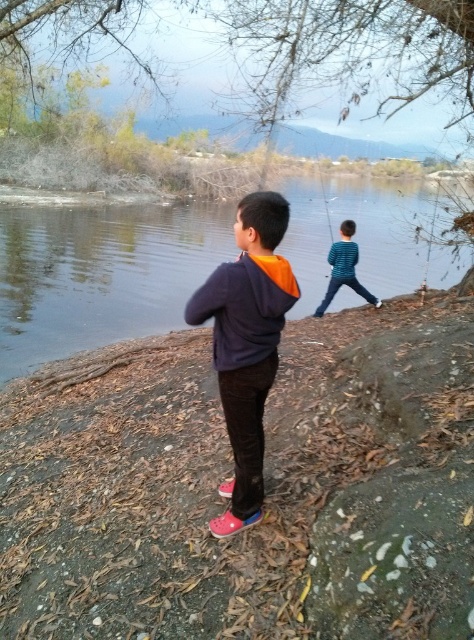
Question: Can you confirm if clear water at center is thinner than orange fleece hoodie at center?

Choices:
 (A) yes
 (B) no

Answer: (B)

Question: Is orange fleece hoodie at center positioned before blue striped shirt at center?

Choices:
 (A) yes
 (B) no

Answer: (A)

Question: Is orange fleece hoodie at center smaller than blue striped shirt at center?

Choices:
 (A) yes
 (B) no

Answer: (A)

Question: Estimate the real-world distances between objects in this image. Which object is closer to the clear water at center?

Choices:
 (A) blue striped shirt at center
 (B) orange fleece hoodie at center

Answer: (A)

Question: Among these objects, which one is nearest to the camera?

Choices:
 (A) clear water at center
 (B) blue striped shirt at center

Answer: (A)

Question: Which point is closer to the camera?

Choices:
 (A) blue striped shirt at center
 (B) clear water at center

Answer: (B)